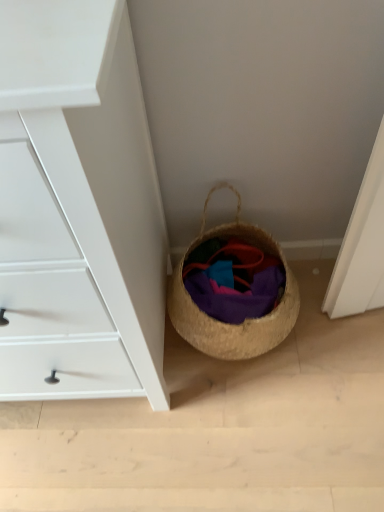
Describe the element at coordinates (233, 280) in the screenshot. This screenshot has width=384, height=512. I see `purple woven fabric at lower center` at that location.

Where is `white matte chest of drawers at lower left`? The height and width of the screenshot is (512, 384). white matte chest of drawers at lower left is located at coordinates (78, 208).

Identify the location of woven straw basket at lower right. (246, 319).

From the picture: Considering the sizes of objects purple woven fabric at lower center and woven straw basket at lower right in the image provided, who is taller, purple woven fabric at lower center or woven straw basket at lower right?

woven straw basket at lower right.

Is purple woven fabric at lower center at the right side of woven straw basket at lower right?

Yes, purple woven fabric at lower center is to the right of woven straw basket at lower right.

From the image's perspective, is purple woven fabric at lower center under woven straw basket at lower right?

Yes.

Are white matte chest of drawers at lower left and woven straw basket at lower right located far from each other?

No.

Is white matte chest of drawers at lower left to the right of woven straw basket at lower right from the viewer's perspective?

In fact, white matte chest of drawers at lower left is to the left of woven straw basket at lower right.

Find the location of `the chest of drawers located above the woven straw basket at lower right (from the image's perspective)`. the chest of drawers located above the woven straw basket at lower right (from the image's perspective) is located at coordinates (78, 208).

This screenshot has height=512, width=384. I want to click on basket that appears on the left of purple woven fabric at lower center, so click(246, 319).

Is woven straw basket at lower right oriented towards purple woven fabric at lower center?

Yes.

Visually, is woven straw basket at lower right positioned to the left or to the right of purple woven fabric at lower center?

Based on their positions, woven straw basket at lower right is located to the left of purple woven fabric at lower center.

From the image's perspective, who appears lower, woven straw basket at lower right or purple woven fabric at lower center?

purple woven fabric at lower center appears lower in the image.

Find the location of a particular element. the chest of drawers located in front of the purple woven fabric at lower center is located at coordinates (78, 208).

Does purple woven fabric at lower center have a smaller size compared to white matte chest of drawers at lower left?

Yes.

Is point (203, 277) positioned before point (75, 214)?

No.

From a real-world perspective, does purple woven fabric at lower center sit lower than white matte chest of drawers at lower left?

Indeed, from a real-world perspective, purple woven fabric at lower center is positioned beneath white matte chest of drawers at lower left.

In terms of width, does white matte chest of drawers at lower left look wider or thinner when compared to purple woven fabric at lower center?

In the image, white matte chest of drawers at lower left appears to be wider than purple woven fabric at lower center.

Based on their positions, is white matte chest of drawers at lower left located to the left or right of purple woven fabric at lower center?

From the image, it's evident that white matte chest of drawers at lower left is to the left of purple woven fabric at lower center.

Between point (18, 288) and point (227, 294), which one is positioned behind?

Point (227, 294)

Do you think white matte chest of drawers at lower left is within purple woven fabric at lower center, or outside of it?

white matte chest of drawers at lower left is not enclosed by purple woven fabric at lower center.

Identify the location of basket beneath the white matte chest of drawers at lower left (from a real-world perspective). The width and height of the screenshot is (384, 512). (246, 319).

Between point (273, 253) and point (93, 62), which one is positioned in front?

The point (93, 62) is more forward.

Considering the positions of objects woven straw basket at lower right and white matte chest of drawers at lower left in the image provided, who is behind, woven straw basket at lower right or white matte chest of drawers at lower left?

woven straw basket at lower right is behind.

Where is `basket in front of the purple woven fabric at lower center`? basket in front of the purple woven fabric at lower center is located at coordinates (246, 319).

Locate an element on the screen. This screenshot has width=384, height=512. basket that is below the white matte chest of drawers at lower left (from the image's perspective) is located at coordinates (246, 319).

When comparing their distances from woven straw basket at lower right, does purple woven fabric at lower center or white matte chest of drawers at lower left seem closer?

The object closer to woven straw basket at lower right is purple woven fabric at lower center.

Based on their spatial positions, is white matte chest of drawers at lower left or purple woven fabric at lower center further from woven straw basket at lower right?

Among the two, white matte chest of drawers at lower left is located further to woven straw basket at lower right.

Which object lies nearer to the anchor point white matte chest of drawers at lower left, purple woven fabric at lower center or woven straw basket at lower right?

woven straw basket at lower right is closer to white matte chest of drawers at lower left.

Based on their spatial positions, is white matte chest of drawers at lower left or woven straw basket at lower right closer to purple woven fabric at lower center?

woven straw basket at lower right.

Estimate the real-world distances between objects in this image. Which object is closer to white matte chest of drawers at lower left, woven straw basket at lower right or purple woven fabric at lower center?

Based on the image, woven straw basket at lower right appears to be nearer to white matte chest of drawers at lower left.

Consider the image. Based on their spatial positions, is woven straw basket at lower right or white matte chest of drawers at lower left closer to purple woven fabric at lower center?

Based on the image, woven straw basket at lower right appears to be nearer to purple woven fabric at lower center.

Find the location of a particular element. The image size is (384, 512). basket between white matte chest of drawers at lower left and purple woven fabric at lower center along the z-axis is located at coordinates (246, 319).